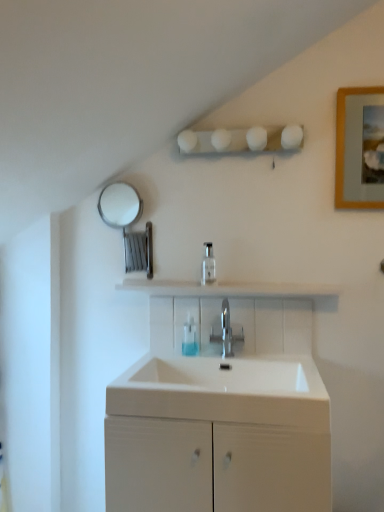
Locate an element on the screen. vacant location below white matte light fixture at upper center (from a real-world perspective) is located at coordinates (248, 280).